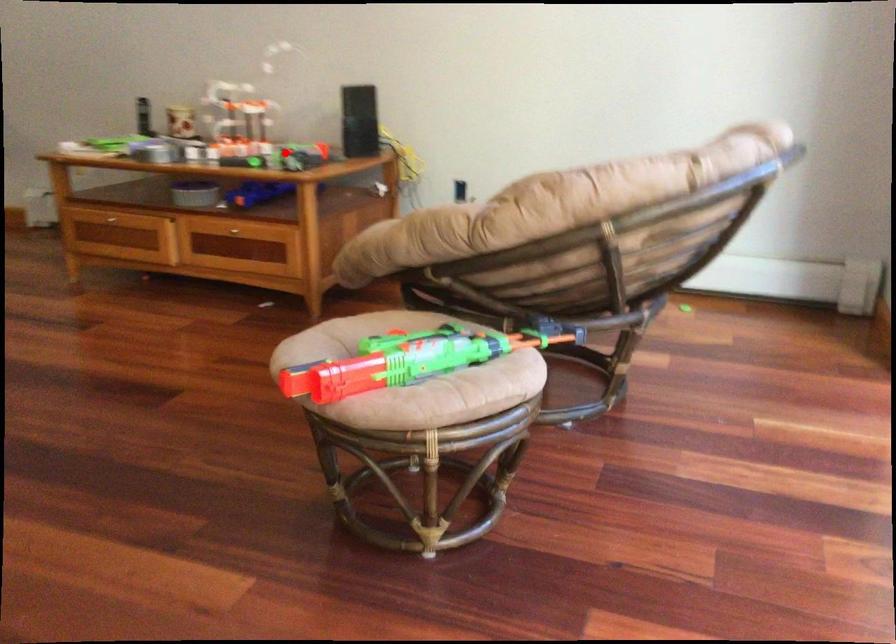
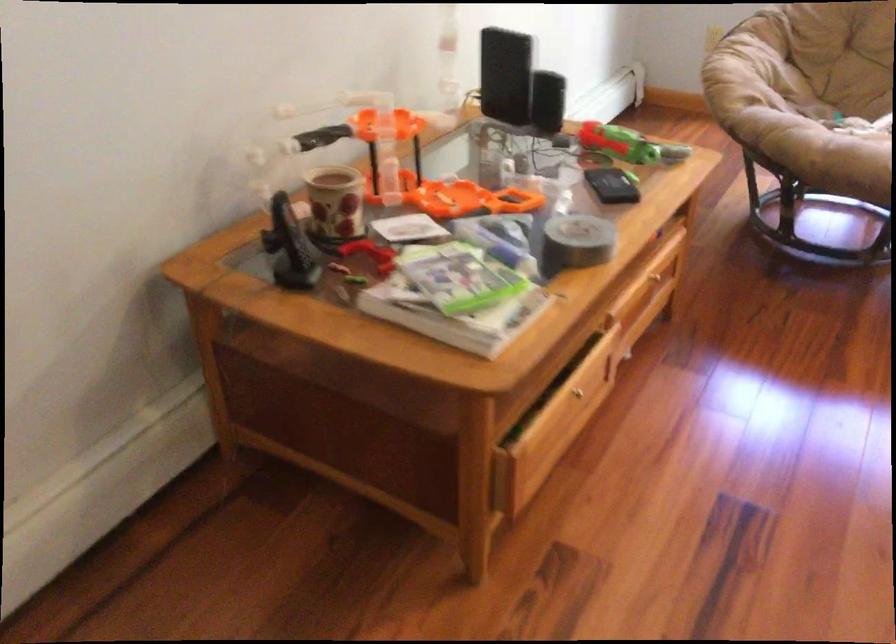
Question: I am providing you with two images of the same scene from different viewpoints. In image1, a red point is highlighted. Considering the same 3D point in image2, which of the following is correct?

Choices:
 (A) It is closer
 (B) It is farther

Answer: (A)